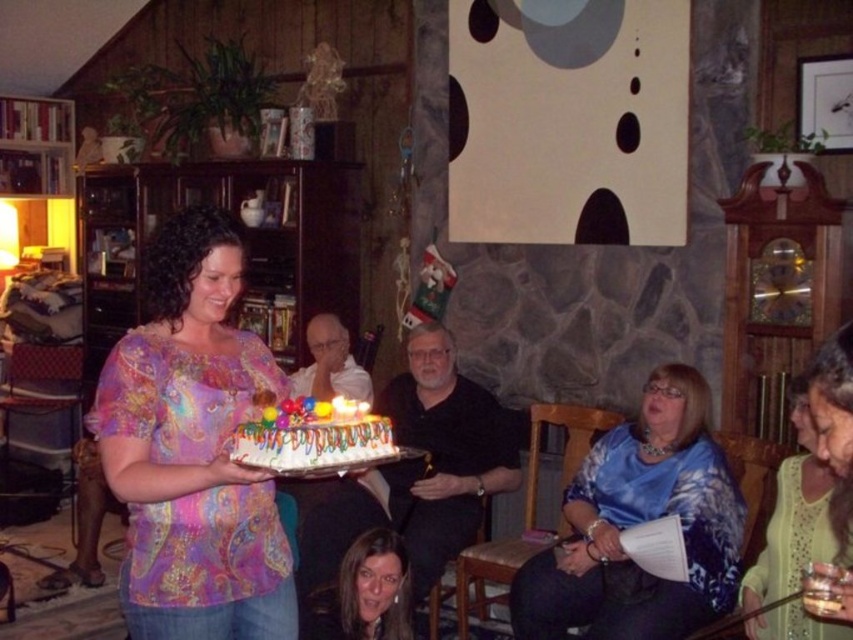
You are a photographer standing in front of the blue floral blouse at center and the white frosted cake with colorful decorations at center. You want to take a photo of both objects clearly. Which object should you focus on first to ensure both are in focus?

You should focus on the blue floral blouse at center first because it is closer to you than the white frosted cake with colorful decorations at center. By focusing on the closer object, the farther one will also be in focus due to the depth of field.

You are a photographer at the birthday party and want to capture a photo of both the multicolored paisley shirt at center and the light green lace dress at lower right. Since you want them to appear balanced in the photo, which clothing item should you move closer to the camera?

The multicolored paisley shirt at center is larger in size than the light green lace dress at lower right. To balance their sizes in the photo, move the light green lace dress at lower right closer to the camera so it appears larger, while keeping the multicolored paisley shirt at center slightly farther back.